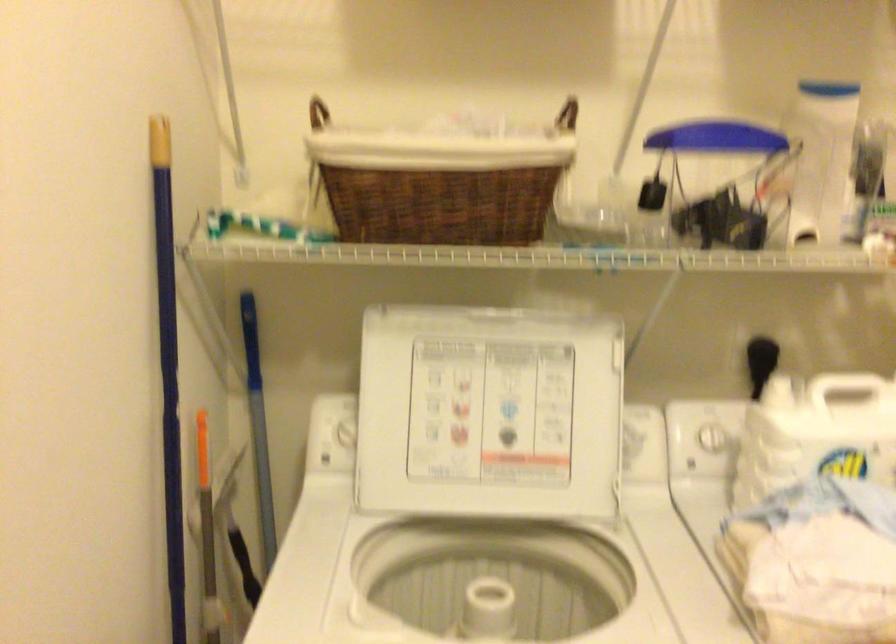
This screenshot has height=644, width=896. Describe the element at coordinates (821, 158) in the screenshot. I see `a detergent bottle handle` at that location.